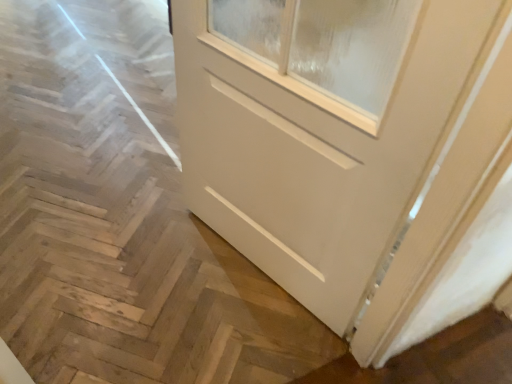
The height and width of the screenshot is (384, 512). Describe the element at coordinates (320, 127) in the screenshot. I see `white matte door at center` at that location.

Where is `white matte door at center`? The height and width of the screenshot is (384, 512). white matte door at center is located at coordinates (320, 127).

At what (x,y) coordinates should I click in order to perform the action: click on white matte door at center. Please return your answer as a coordinate pair (x, y). Looking at the image, I should click on (320, 127).